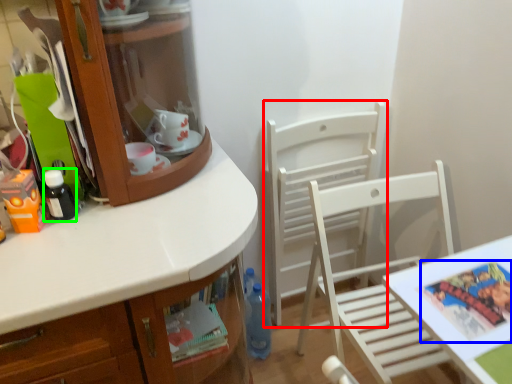
Question: Which is farther away from chair (highlighted by a red box)? comic book (highlighted by a blue box) or bottle (highlighted by a green box)?

Choices:
 (A) comic book
 (B) bottle

Answer: (B)